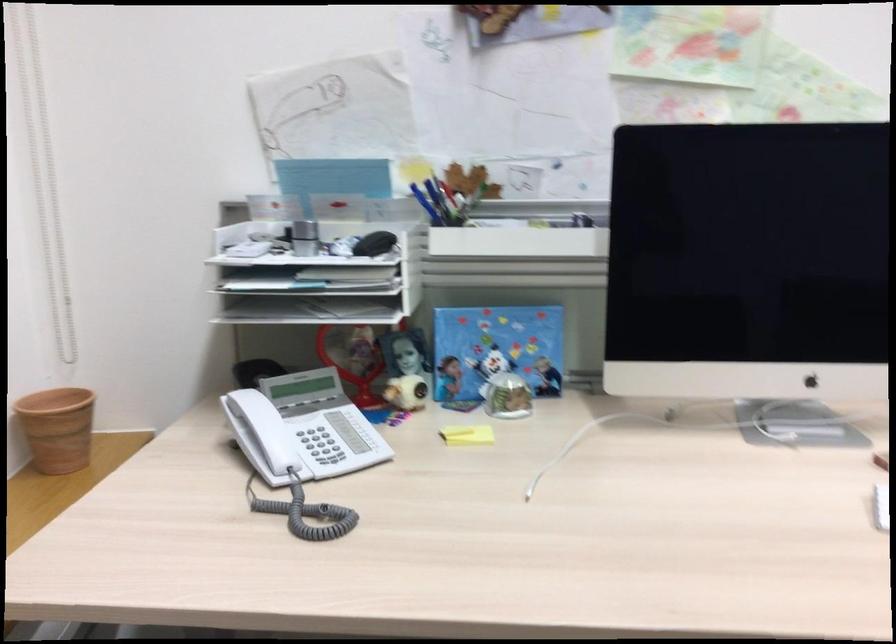
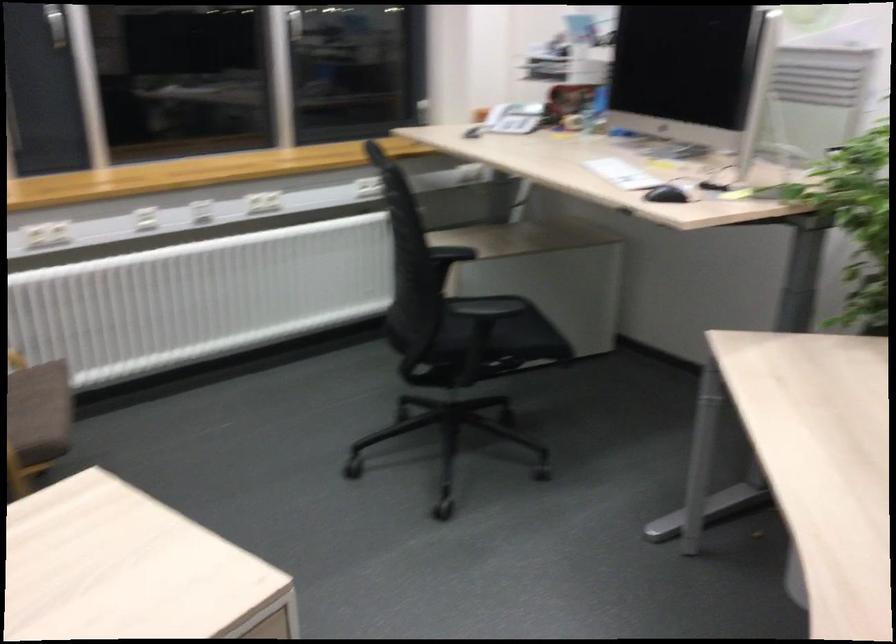
In the second image, find the point that corresponds to the point at 282,448 in the first image.

(496, 115)